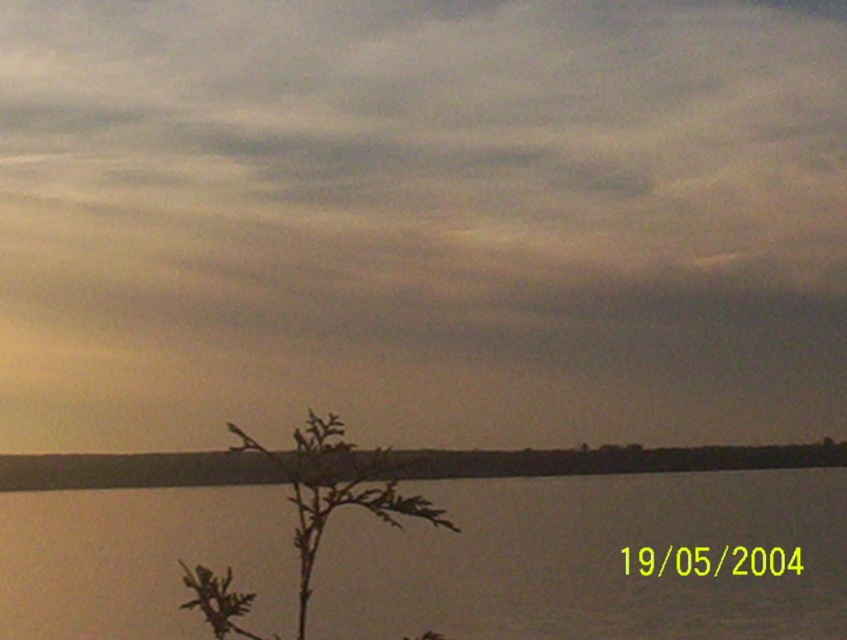
Between point (649, 413) and point (297, 513), which one is positioned behind?

Positioned behind is point (649, 413).

Looking at this image, is gray matte cloud at upper center thinner than green leafy plant at lower left?

Incorrect, gray matte cloud at upper center's width is not less than green leafy plant at lower left's.

Identify the location of gray matte cloud at upper center. click(421, 220).

You are a GUI agent. You are given a task and a screenshot of the screen. Output one action in this format:
    pyautogui.click(x=<x>, y=<y>)
    Task: Click on the gray matte cloud at upper center
    The image size is (847, 640).
    Given the screenshot: What is the action you would take?
    421,220

Which is above, transparent water at bottom or green leafy plant at lower left?

green leafy plant at lower left is above.

Which is below, transparent water at bottom or green leafy plant at lower left?

Positioned lower is transparent water at bottom.

Who is more forward, (397,566) or (333,481)?

Point (333,481) is in front.

The width and height of the screenshot is (847, 640). I want to click on transparent water at bottom, so click(590, 561).

Between gray matte cloud at upper center and transparent water at bottom, which one is positioned higher?

gray matte cloud at upper center

Which of these two, gray matte cloud at upper center or transparent water at bottom, stands shorter?

Standing shorter between the two is transparent water at bottom.

Does point (618, 285) come in front of point (10, 582)?

No, it is behind (10, 582).

You are a GUI agent. You are given a task and a screenshot of the screen. Output one action in this format:
    pyautogui.click(x=<x>, y=<y>)
    Task: Click on the gray matte cloud at upper center
    Image resolution: width=847 pixels, height=640 pixels.
    Given the screenshot: What is the action you would take?
    pyautogui.click(x=421, y=220)